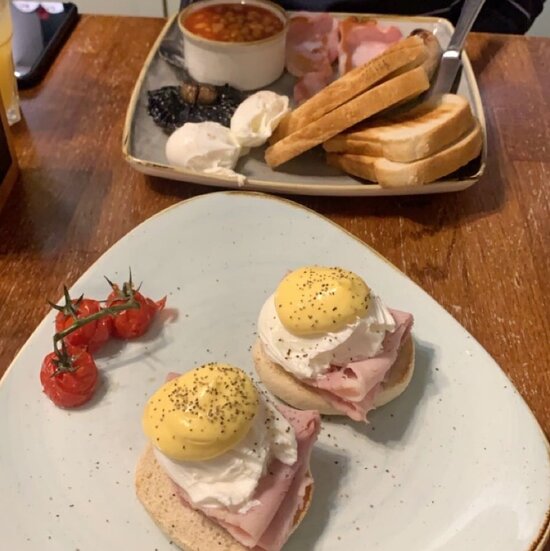
Identify the location of table. (60, 248).